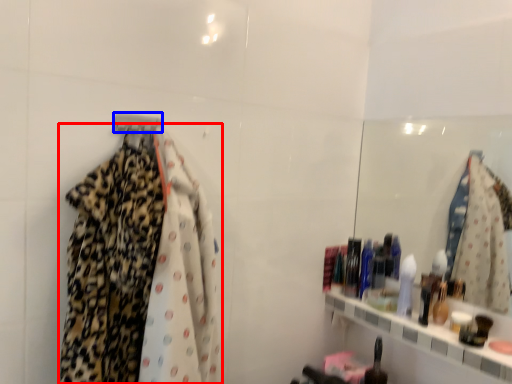
Question: Which object appears farthest to the camera in this image, fancy dress (highlighted by a red box) or hanger (highlighted by a blue box)?

Choices:
 (A) fancy dress
 (B) hanger

Answer: (B)